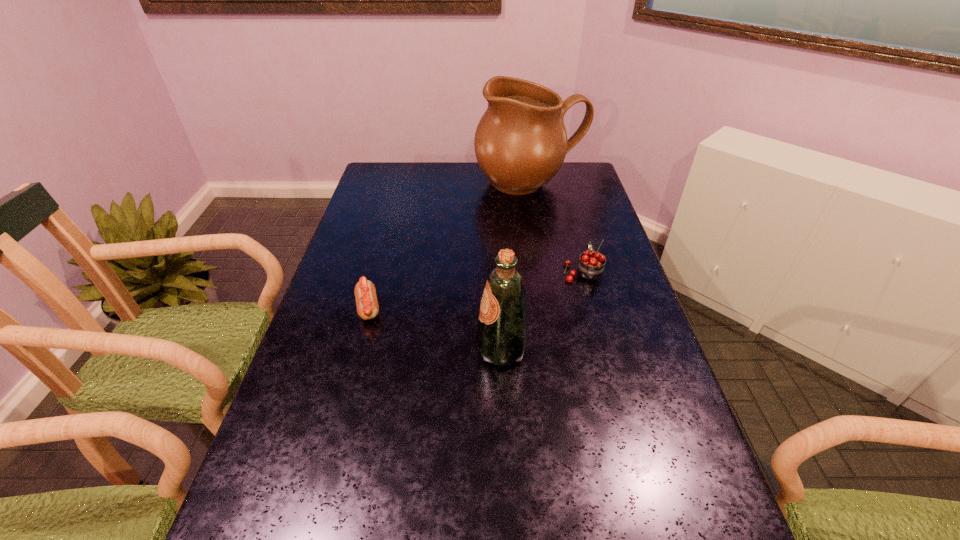
Identify the location of object that is at the far right corner. (520, 143).

Identify the location of free space at the far edge of the desktop. The height and width of the screenshot is (540, 960). (499, 192).

This screenshot has height=540, width=960. Find the location of `vacant space at the left edge`. vacant space at the left edge is located at coordinates (x=347, y=441).

Where is `free spot at the right edge of the desktop`? free spot at the right edge of the desktop is located at coordinates (620, 269).

The image size is (960, 540). I want to click on free space at the far left corner of the desktop, so click(x=391, y=170).

Locate an element on the screen. Image resolution: width=960 pixels, height=540 pixels. blank region between the second shortest object and the cream pitcher is located at coordinates (557, 228).

The image size is (960, 540). Identify the location of vacant point located between the olive oil and the third tallest object. (542, 310).

Where is `empty space between the nearest object and the farthest object`? empty space between the nearest object and the farthest object is located at coordinates (516, 267).

At what (x,y) coordinates should I click in order to perform the action: click on free space that is in between the tallest object and the leftmost object. Please return your answer as a coordinate pair (x, y). This screenshot has width=960, height=540. Looking at the image, I should click on (449, 246).

The image size is (960, 540). I want to click on free space between the cherry and the leftmost object, so click(475, 290).